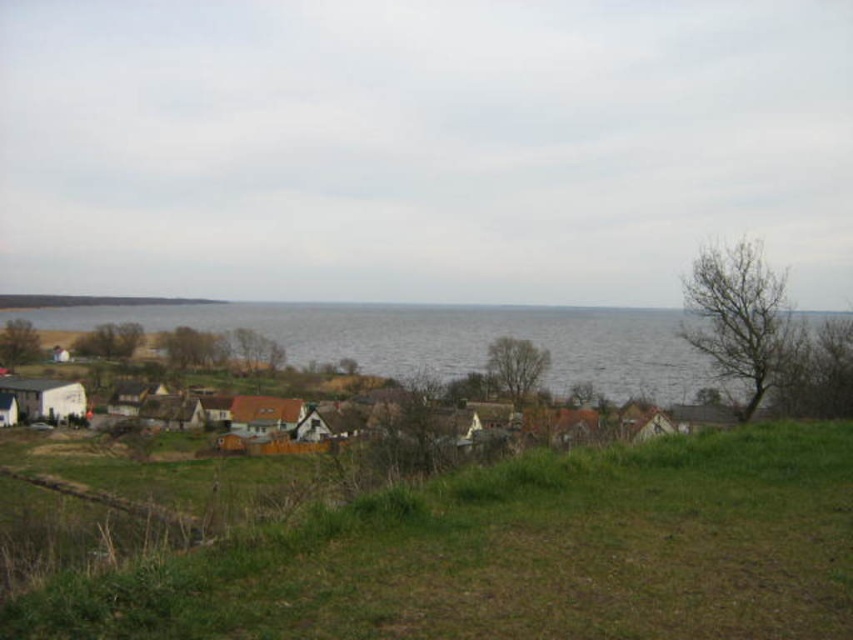
Based on the photo, is green grassy field at lower center closer to camera compared to white wooden houses at lower left?

Yes.

Does green grassy field at lower center have a lesser width compared to white wooden houses at lower left?

Correct, green grassy field at lower center's width is less than white wooden houses at lower left's.

Does point (201, 612) lie in front of point (186, 410)?

That is True.

I want to click on green grassy field at lower center, so click(x=518, y=554).

Does point (415, 310) lie in front of point (167, 403)?

No, it is behind (167, 403).

From the picture: Can you confirm if gray water at center is positioned above white wooden houses at lower left?

Yes.

Who is more forward, (x=698, y=365) or (x=665, y=428)?

Point (x=665, y=428) is in front.

This screenshot has height=640, width=853. Find the location of `gray water at center`. gray water at center is located at coordinates (439, 339).

Is green grassy field at lower center behind gray water at center?

No, green grassy field at lower center is closer to the viewer.

Between point (781, 490) and point (440, 330), which one is positioned in front?

Point (781, 490)

Identify the location of green grassy field at lower center. (518, 554).